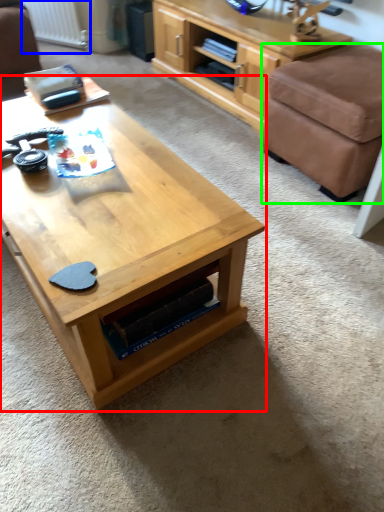
Question: Estimate the real-world distances between objects in this image. Which object is farther from coffee table (highlighted by a red box), radiator (highlighted by a blue box) or stool (highlighted by a green box)?

Choices:
 (A) radiator
 (B) stool

Answer: (A)